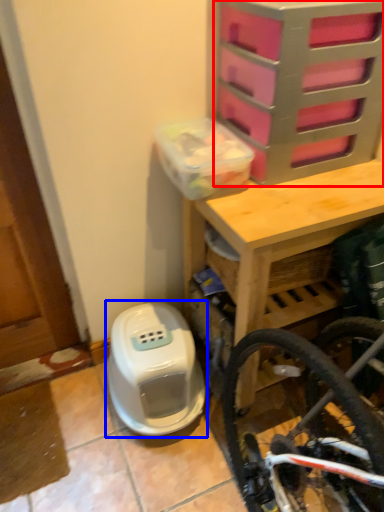
Question: Which object is closer to the camera taking this photo, drawer (highlighted by a red box) or water heater (highlighted by a blue box)?

Choices:
 (A) drawer
 (B) water heater

Answer: (A)